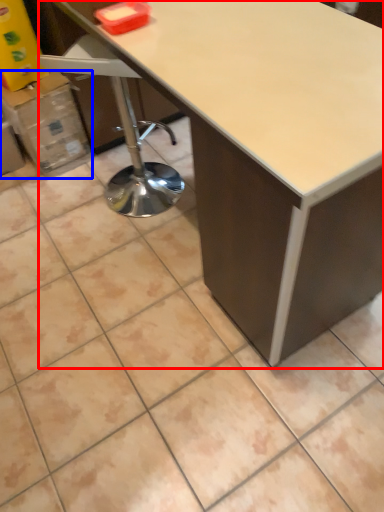
Question: Which of the following is the closest to the observer, table (highlighted by a red box) or cardboard box (highlighted by a blue box)?

Choices:
 (A) table
 (B) cardboard box

Answer: (A)